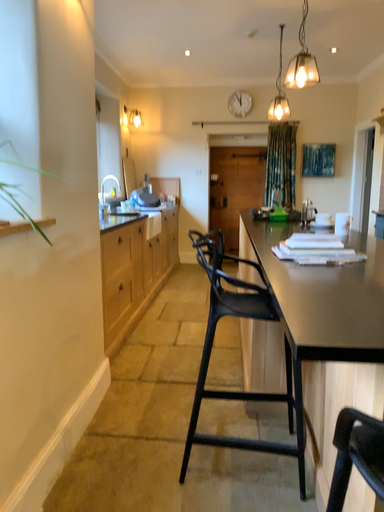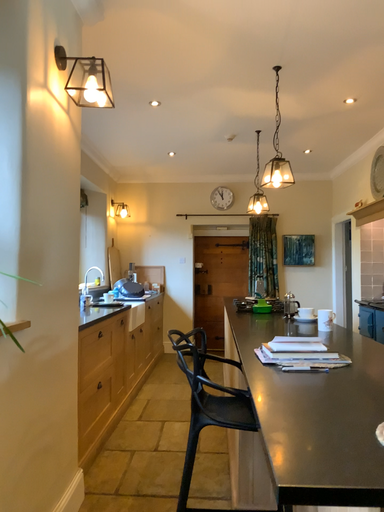
Question: Which way did the camera rotate in the video?

Choices:
 (A) rotated downward
 (B) rotated upward

Answer: (B)